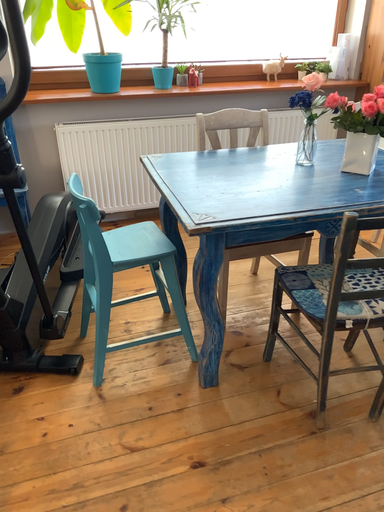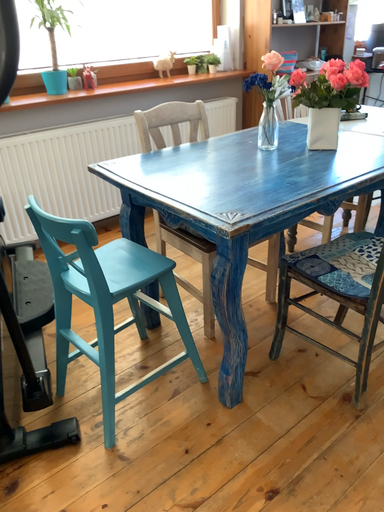
Question: Which way did the camera rotate in the video?

Choices:
 (A) rotated right
 (B) rotated left

Answer: (A)